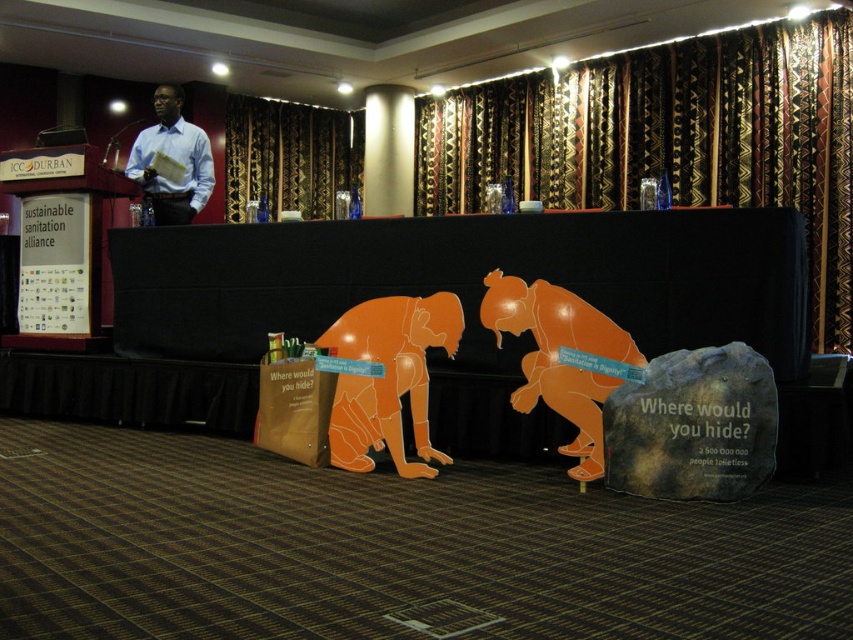
You are a stagehand preparing for a presentation. You need to place a 10 feet long microphone cable from the patterned fabric curtain at upper center to the blue shirt at upper left. Will the cable reach both objects without needing to be extended?

The distance between the patterned fabric curtain at upper center and the blue shirt at upper left is 11.89 feet. Since the microphone cable is only 10 feet long, it will not be sufficient to reach both objects without extension.

You are sitting in the audience and want to know which of the two points, point (274, 212) or point (148, 163), is closer to you. Based on the scene, can you determine this?

Point (274, 212) is closer to you because it is further to the viewer than point (148, 163).